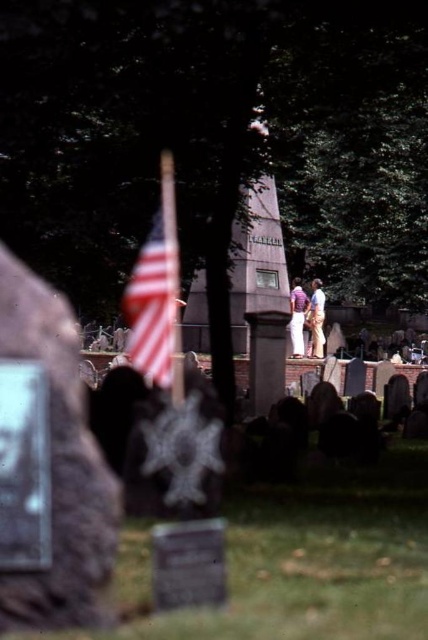
You are a photographer standing in the cemetery and want to capture both the american flag at center and the purple cotton shirt at center in a single photo. Which object should you ensure is closer to the camera to include both in the frame without cropping?

The american flag at center is not as tall as the purple cotton shirt at center, so you should ensure the purple cotton shirt at center is closer to the camera to include both in the frame without cropping.

You are a photographer planning to take a photo of the american flag at center and purple cotton shirt at center in the cemetery scene. Which object should you focus on if you want the larger one to be in sharp focus?

The american flag at center has a larger size compared to the purple cotton shirt at center, so you should focus on the american flag at center to ensure it is in sharp focus.

You are standing in the cemetery and want to take a photo of both the gravestone with the American flag and the obelisk monument. If you focus on point 1 at point (305, 317) and point 2 at point (312, 301), which point should you focus on to ensure both objects are in clear view?

You should focus on point 1 at point (305, 317) because it is closer to the camera than point 2 at point (312, 301). This will help ensure both objects are in clear view.